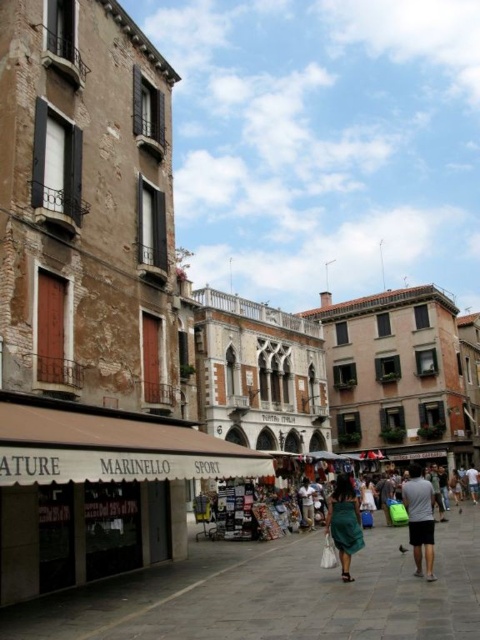
Question: Among these points, which one is farthest from the camera?

Choices:
 (A) (308, 490)
 (B) (34, 472)
 (C) (336, 532)

Answer: (A)

Question: Which object appears closest to the camera in this image?

Choices:
 (A) gray cotton shirt at center
 (B) green fabric skirt at center
 (C) green fabric dress at center

Answer: (A)

Question: Does gray cotton shirt at center appear on the right side of green fabric skirt at center?

Choices:
 (A) no
 (B) yes

Answer: (B)

Question: Can you confirm if gray cotton shirt at center is wider than green fabric dress at center?

Choices:
 (A) yes
 (B) no

Answer: (A)

Question: Is green fabric skirt at center further to the viewer compared to green fabric dress at center?

Choices:
 (A) no
 (B) yes

Answer: (A)

Question: Which point is closer to the camera taking this photo?

Choices:
 (A) (415, 540)
 (B) (128, 547)

Answer: (A)